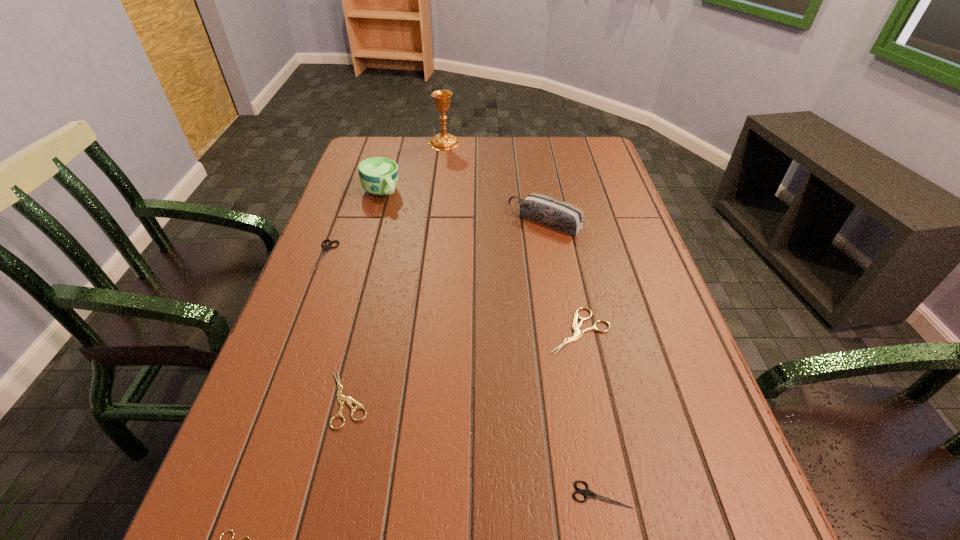
Where is `gold chalice`? This screenshot has width=960, height=540. gold chalice is located at coordinates (443, 141).

You are a GUI agent. You are given a task and a screenshot of the screen. Output one action in this format:
    pyautogui.click(x=<x>, y=<y>)
    Task: Click on the fourth object from right to left
    This screenshot has width=960, height=540.
    Given the screenshot: What is the action you would take?
    [443, 141]

Where is `blue cup`? blue cup is located at coordinates (378, 176).

Locate an element on the screen. The width and height of the screenshot is (960, 540). the seventh shortest object is located at coordinates (378, 176).

The width and height of the screenshot is (960, 540). What are the coordinates of `pencil box` in the screenshot? It's located at (554, 213).

Where is `the third tallest object`? the third tallest object is located at coordinates (554, 213).

The width and height of the screenshot is (960, 540). I want to click on the fifth nearest object, so click(326, 247).

Image resolution: width=960 pixels, height=540 pixels. I want to click on the farthest shears, so click(x=326, y=247).

I want to click on the fifth farthest object, so [x=578, y=333].

The width and height of the screenshot is (960, 540). Identify the location of the farthest beige shears. (578, 333).